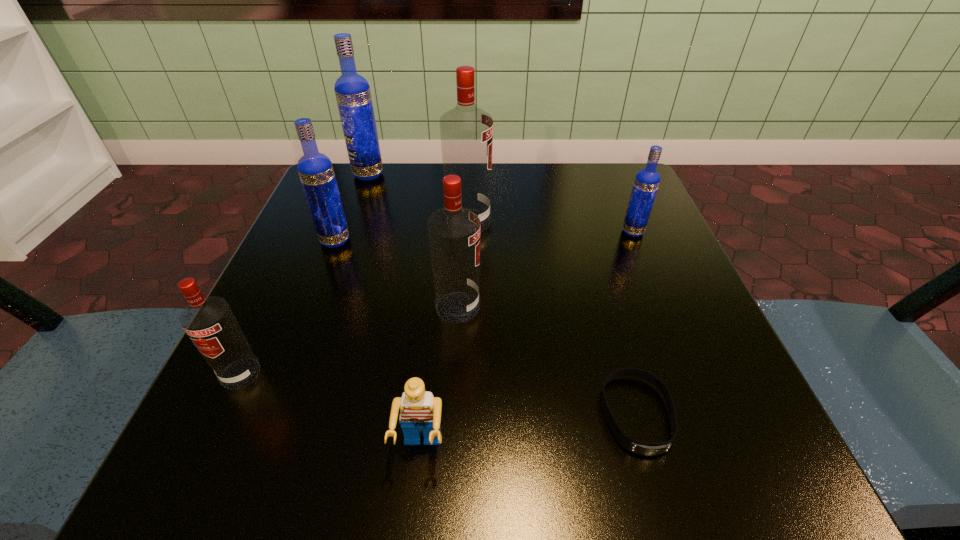
Where is `the farthest object`? the farthest object is located at coordinates (352, 91).

Identify the location of the farthest vodka. This screenshot has height=540, width=960. (352, 91).

I want to click on the biggest red vodka, so click(x=466, y=131).

Where is `the second smallest blue vodka`? The image size is (960, 540). the second smallest blue vodka is located at coordinates (315, 169).

Identify the location of the second farthest red vodka. This screenshot has width=960, height=540. (454, 231).

Where is `the second biggest red vodka`? This screenshot has height=540, width=960. the second biggest red vodka is located at coordinates (454, 231).

Identify the location of the rightmost blue vodka. (647, 180).

Identify the location of the rightmost vodka. (647, 180).

Where is `the smallest red vodka`? the smallest red vodka is located at coordinates (209, 322).

Locate an element on the screen. the leftmost red vodka is located at coordinates (209, 322).